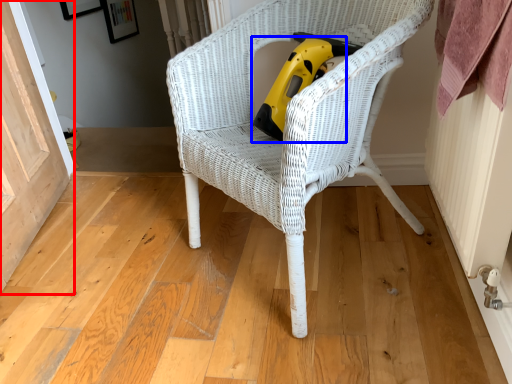
Question: Which of the following is the closest to the observer, screen door (highlighted by a red box) or vacuum (highlighted by a blue box)?

Choices:
 (A) screen door
 (B) vacuum

Answer: (A)